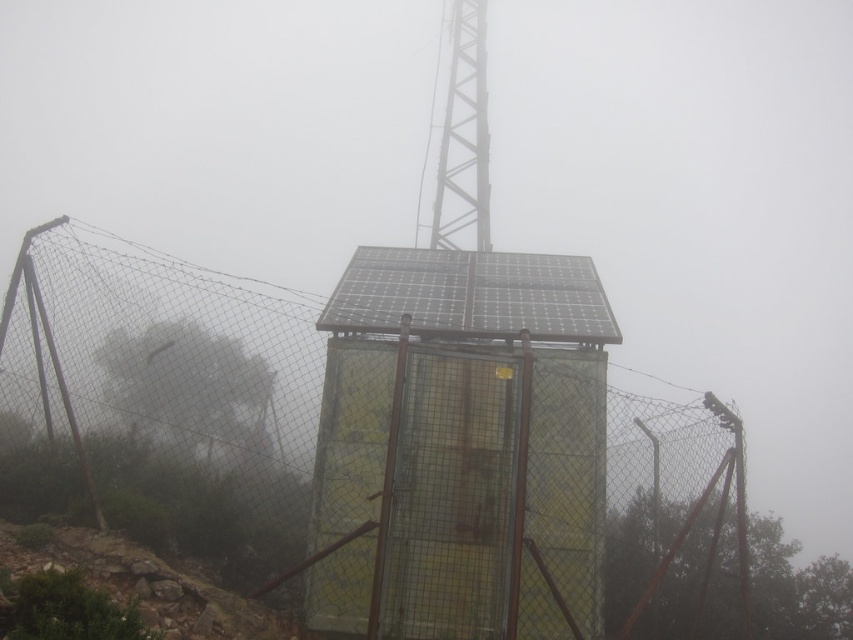
Which is below, wire mesh fence at center or metallic yellow cage at center?

wire mesh fence at center

Does wire mesh fence at center have a lesser height compared to metallic yellow cage at center?

No.

Is point (469, 349) positioned behind point (427, 374)?

Yes.

The width and height of the screenshot is (853, 640). What are the coordinates of `wire mesh fence at center` in the screenshot? It's located at (372, 440).

Is metallic yellow cage at center to the left of metallic gray tower at upper center from the viewer's perspective?

Indeed, metallic yellow cage at center is positioned on the left side of metallic gray tower at upper center.

Find the location of a particular element. This screenshot has height=640, width=853. metallic yellow cage at center is located at coordinates (461, 444).

What do you see at coordinates (461, 444) in the screenshot? I see `metallic yellow cage at center` at bounding box center [461, 444].

Where is `metallic yellow cage at center`? This screenshot has height=640, width=853. metallic yellow cage at center is located at coordinates (461, 444).

Who is more forward, (346,520) or (477,163)?

Point (346,520) is in front.

Is point (569, 492) positioned before point (434, 188)?

Yes, it is.

Find the location of a particular element. wire mesh fence at center is located at coordinates point(372,440).